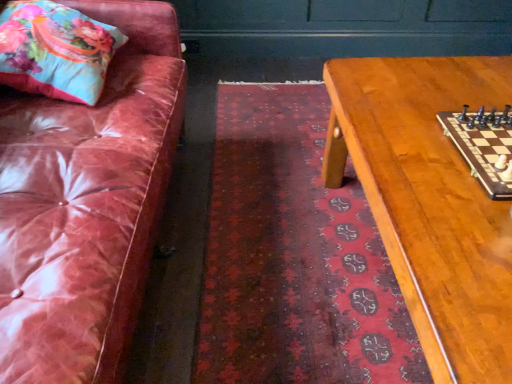
Question: Is dark red textured rug at center further to the viewer compared to wooden chessboard at center?

Choices:
 (A) yes
 (B) no

Answer: (A)

Question: Considering the relative positions of dark red textured rug at center and wooden chessboard at center in the image provided, is dark red textured rug at center to the right of wooden chessboard at center from the viewer's perspective?

Choices:
 (A) no
 (B) yes

Answer: (A)

Question: Can you confirm if dark red textured rug at center is positioned to the left of wooden chessboard at center?

Choices:
 (A) no
 (B) yes

Answer: (B)

Question: Does dark red textured rug at center turn towards wooden chessboard at center?

Choices:
 (A) yes
 (B) no

Answer: (B)

Question: Is dark red textured rug at center facing away from wooden chessboard at center?

Choices:
 (A) yes
 (B) no

Answer: (B)

Question: Is dark red textured rug at center not within wooden chessboard at center?

Choices:
 (A) yes
 (B) no

Answer: (A)

Question: Considering the relative sizes of dark red textured rug at center and floral fabric pillow at upper left in the image provided, is dark red textured rug at center bigger than floral fabric pillow at upper left?

Choices:
 (A) no
 (B) yes

Answer: (A)

Question: Is dark red textured rug at center closer to the viewer compared to floral fabric pillow at upper left?

Choices:
 (A) yes
 (B) no

Answer: (A)

Question: Is dark red textured rug at center smaller than floral fabric pillow at upper left?

Choices:
 (A) no
 (B) yes

Answer: (B)

Question: From the image's perspective, does dark red textured rug at center appear higher than floral fabric pillow at upper left?

Choices:
 (A) yes
 (B) no

Answer: (B)

Question: From the image's perspective, is dark red textured rug at center below floral fabric pillow at upper left?

Choices:
 (A) yes
 (B) no

Answer: (A)

Question: Is dark red textured rug at center positioned far away from floral fabric pillow at upper left?

Choices:
 (A) yes
 (B) no

Answer: (B)

Question: Is dark red textured rug at center a part of floral fabric pillow at upper left?

Choices:
 (A) no
 (B) yes

Answer: (A)